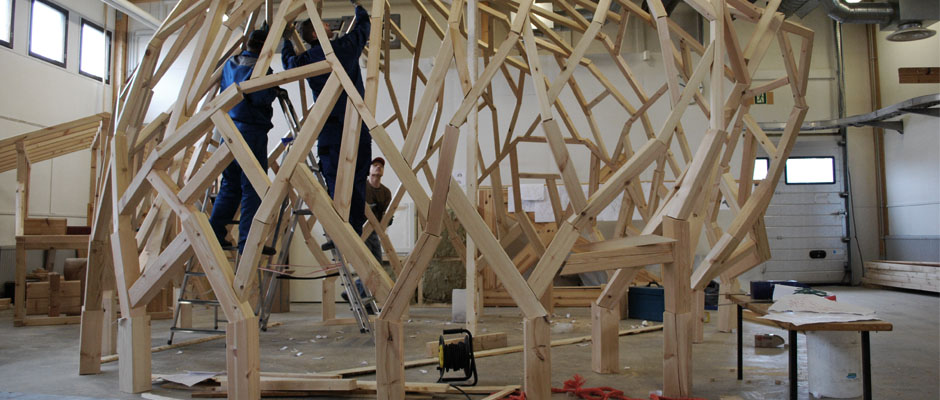
Image resolution: width=940 pixels, height=400 pixels. Identify the location of table. (804, 318).